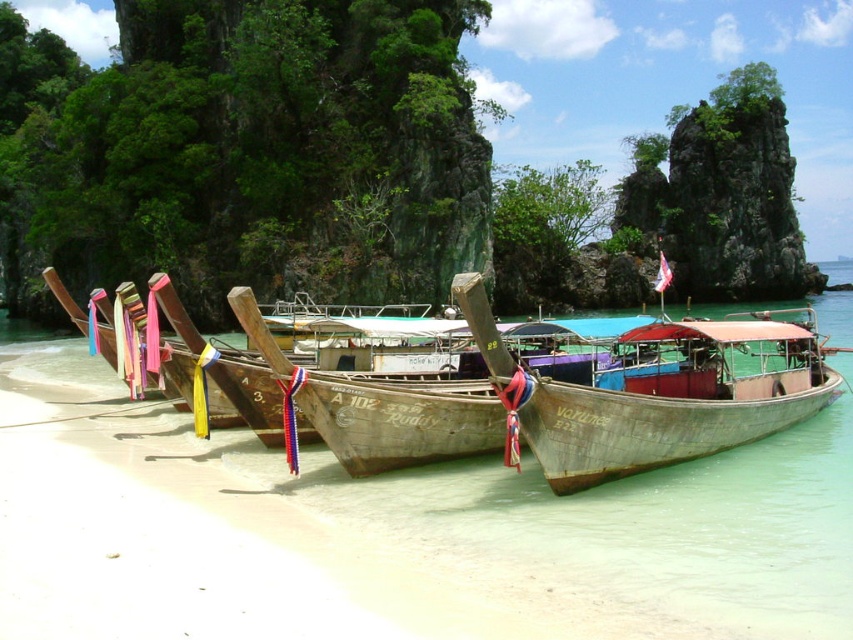
You are a tour guide preparing to board one of the boats for a sightseeing trip. You need to choose a boat that can accommodate 10 passengers comfortably. Which boat between the wooden longboat at center and the wooden boat at center should you select based on their sizes?

The wooden longboat at center has a larger width than the wooden boat at center, so it can accommodate more passengers comfortably.

Looking at this image, you are a tourist standing on the beach and want to take a photo of both the wooden longboat at center and the wooden boat at center. However, you notice that one of them is blocking the view of the other. Which boat is covering part of the other boat in the image?

The wooden longboat at center is positioned over wooden boat at center, so it is covering part of the wooden boat at center.

You are a photographer standing at the shore, and you want to take a picture of the wooden longboat at center. If your camera has a maximum focus range of 14 meters, will you be able to capture it clearly?

The wooden longboat at center is 14.10 meters from camera, which is slightly beyond the camera maximum focus range of 14 meters. Therefore, the camera may not be able to focus on it clearly.